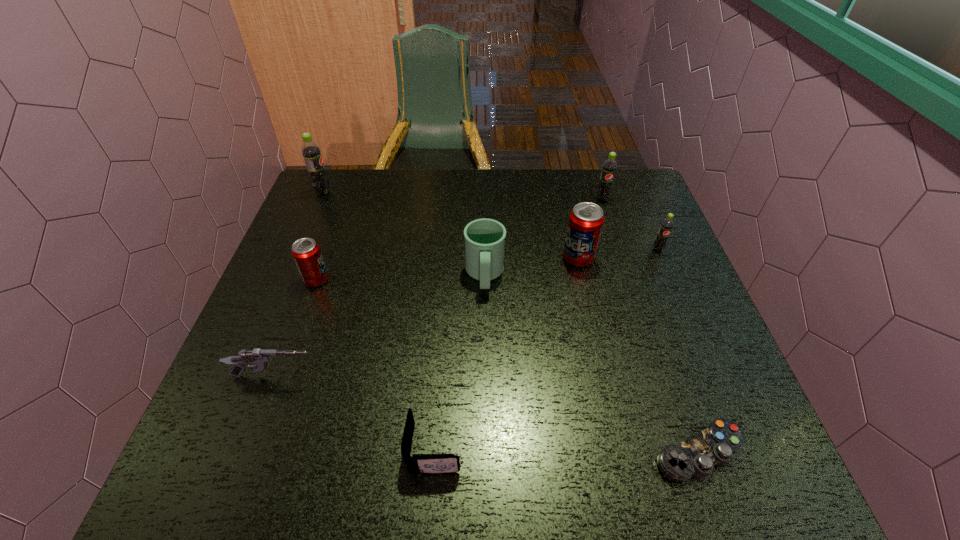
Image resolution: width=960 pixels, height=540 pixels. What are the coordinates of `object that is at the near right corner` in the screenshot? It's located at (698, 455).

This screenshot has height=540, width=960. What are the coordinates of `free space at the far edge of the desktop` in the screenshot? It's located at (518, 179).

The image size is (960, 540). I want to click on vacant space at the left edge, so click(x=299, y=238).

Find the location of a particular element. The height and width of the screenshot is (540, 960). vacant space at the right edge of the desktop is located at coordinates (660, 315).

Image resolution: width=960 pixels, height=540 pixels. Identify the location of vacant area between the nearest green soda and the third shortest object. (467, 313).

You are a GUI agent. You are given a task and a screenshot of the screen. Output one action in this format:
    pyautogui.click(x=<x>, y=<y>)
    Task: Click on the vacant area that lies between the shortest object and the second biggest green soda
    This screenshot has width=960, height=540.
    Given the screenshot: What is the action you would take?
    pyautogui.click(x=651, y=325)

Where is `free space between the second shortest object and the green mug`? free space between the second shortest object and the green mug is located at coordinates (460, 362).

Where is `empty space that is in between the gun and the bigger red soda can`? empty space that is in between the gun and the bigger red soda can is located at coordinates (426, 317).

The image size is (960, 540). Identify the location of vacant space that's between the green mug and the third shortest object. (379, 326).

The image size is (960, 540). Identify the location of vacant area between the gun and the rightmost green soda. (467, 313).